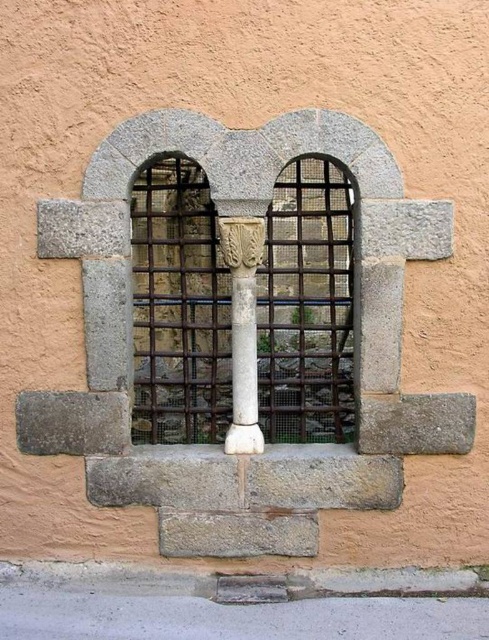
You are standing in front of the wall with the niche and metal grate. There are two points marked on the image at coordinates point [167,252] and point [228,230]. Which point is closer to you?

Point [167,252] is further to the camera than point [228,230], so the point closer to you is point [228,230].

You are standing in front of the wall with the warm, earthy orange hue. There is a point marked at coordinates (178, 308). What object does this point indicate on the wall?

The point at coordinates (178, 308) marks the stone arched window at center.